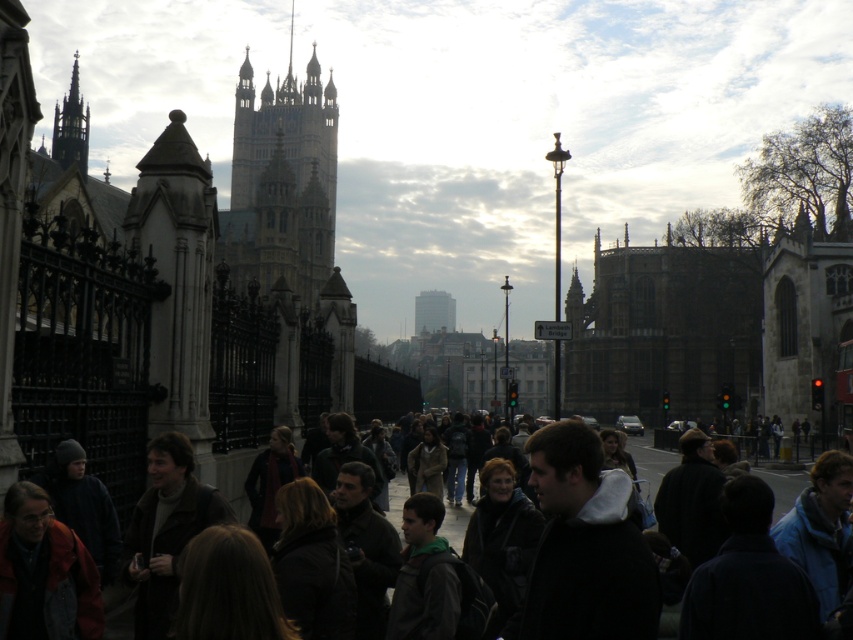
Can you confirm if dark brown leather jacket at center is positioned to the left of dark gray stone spire at upper left?

In fact, dark brown leather jacket at center is to the right of dark gray stone spire at upper left.

Is point (654, 472) in front of point (86, 154)?

Yes, point (654, 472) is closer to viewer.

Identify the location of dark brown leather jacket at center. (650, 460).

Is golden stone tower at upper center shorter than dark brown leather jacket at center?

In fact, golden stone tower at upper center may be taller than dark brown leather jacket at center.

The width and height of the screenshot is (853, 640). In order to click on golden stone tower at upper center in this screenshot , I will do `click(282, 182)`.

Is golden stone tower at upper center positioned before dark gray stone spire at upper left?

Yes, it is in front of dark gray stone spire at upper left.

Does golden stone tower at upper center have a smaller size compared to dark gray stone spire at upper left?

No.

Between point (285, 157) and point (80, 118), which one is positioned in front?

Point (80, 118)

You are a GUI agent. You are given a task and a screenshot of the screen. Output one action in this format:
    pyautogui.click(x=<x>, y=<y>)
    Task: Click on the golden stone tower at upper center
    Image resolution: width=853 pixels, height=640 pixels.
    Given the screenshot: What is the action you would take?
    pyautogui.click(x=282, y=182)